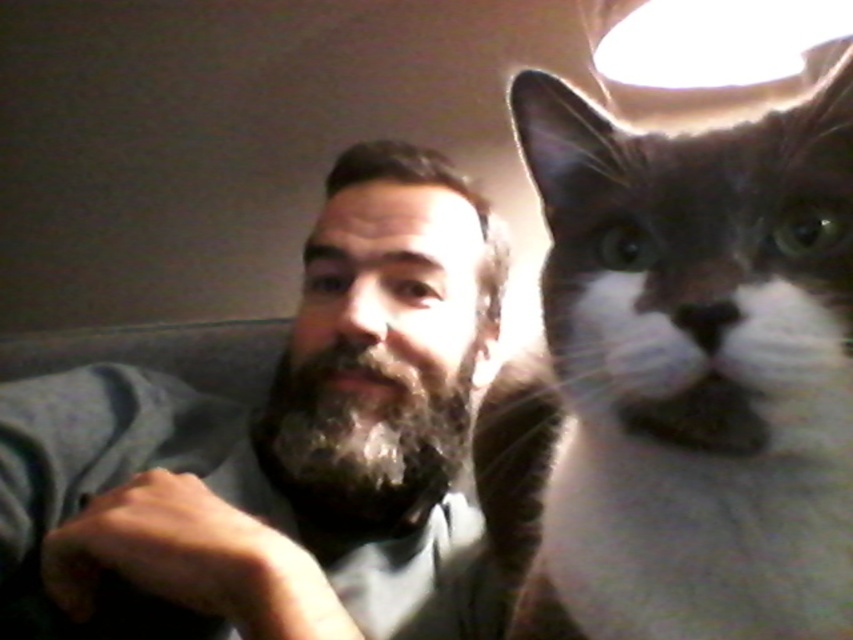
Can you confirm if gray-white fur cat at right is positioned to the right of bearded man at left?

Correct, you'll find gray-white fur cat at right to the right of bearded man at left.

Does gray-white fur cat at right have a greater width compared to bearded man at left?

No, gray-white fur cat at right is not wider than bearded man at left.

Identify the location of gray-white fur cat at right. (694, 372).